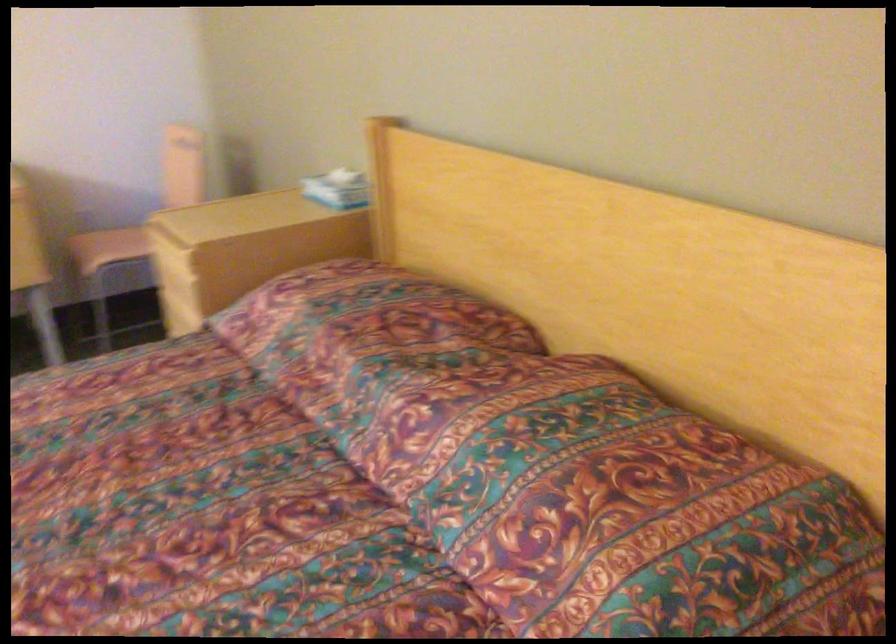
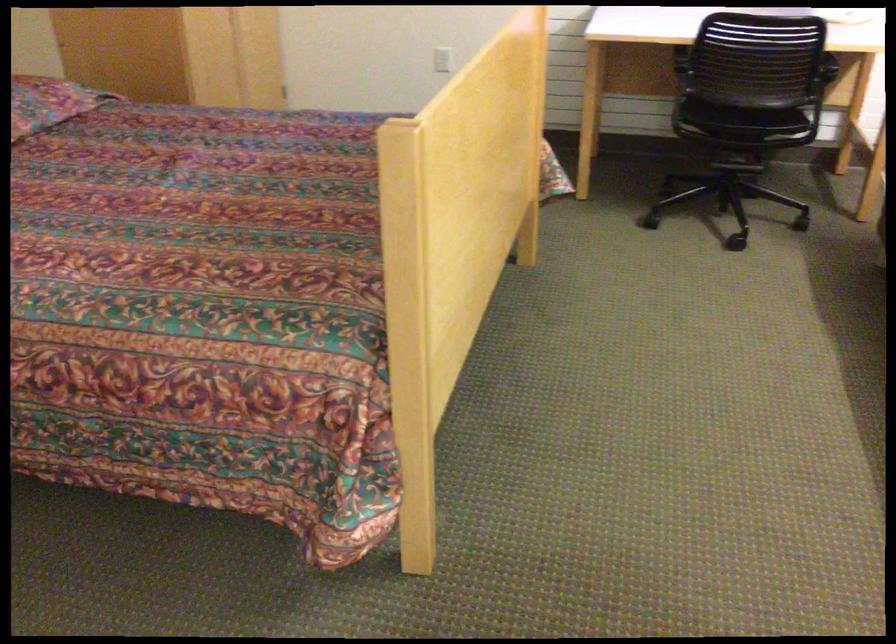
Find the pixel in the second image that matches pixel 538 538 in the first image.

(48, 102)